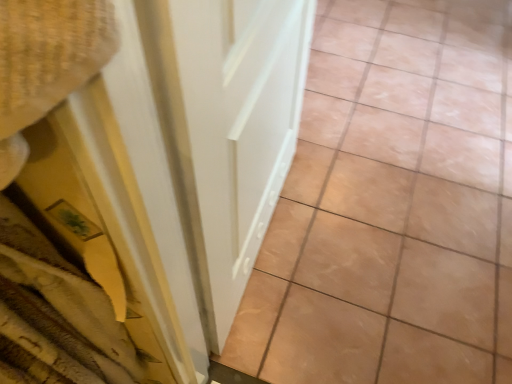
The image size is (512, 384). Identify the location of free space above beige glossy tile at center (from a real-world perspective). (398, 70).